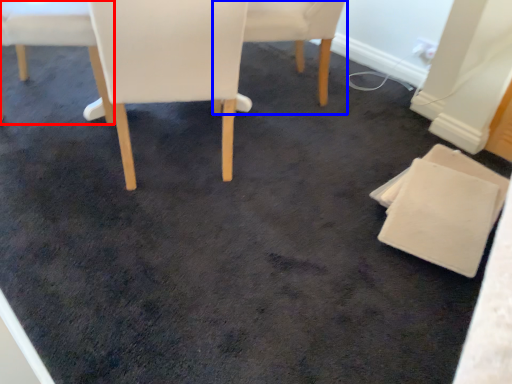
Question: Which object appears farthest to the camera in this image, chair (highlighted by a red box) or chair (highlighted by a blue box)?

Choices:
 (A) chair
 (B) chair

Answer: (B)